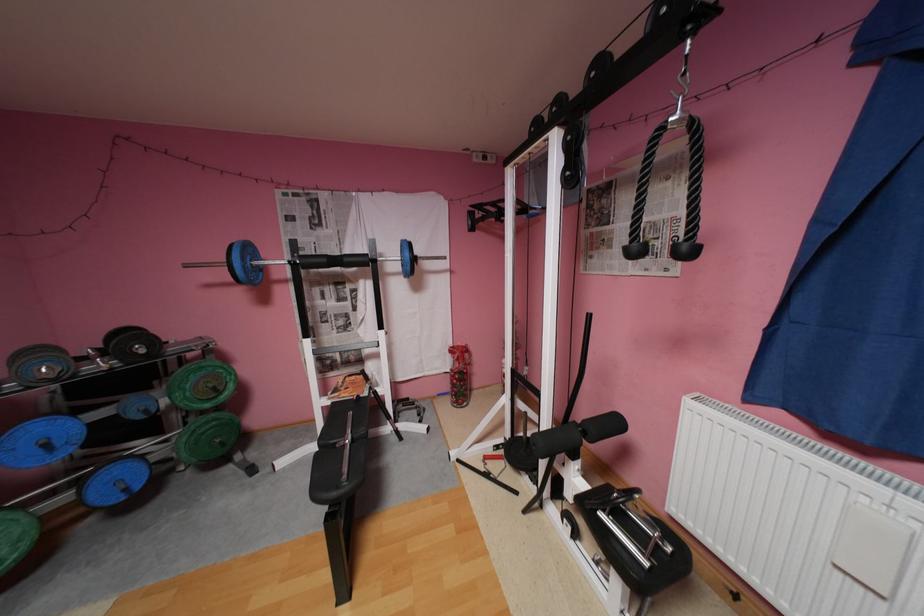
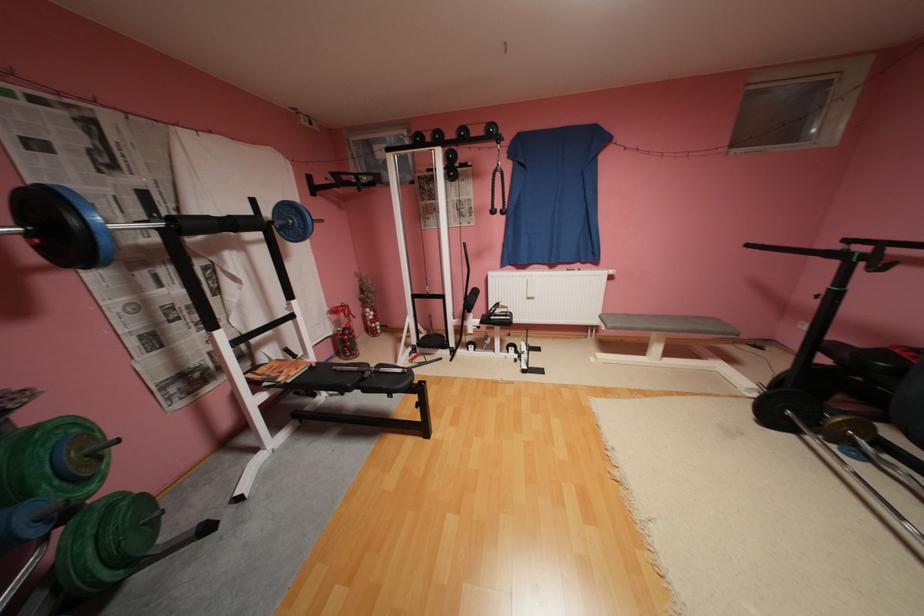
In the second image, find the point that corresponds to (x=646, y=251) in the first image.

(502, 212)